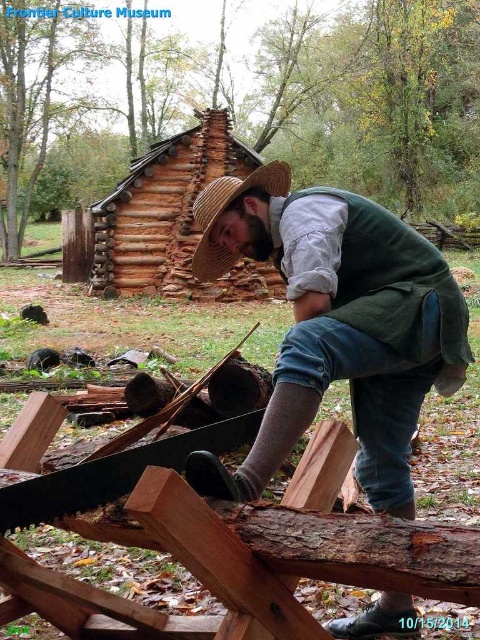
Question: Is green woolen vest at center below strawmaterial/texturehat at center?

Choices:
 (A) no
 (B) yes

Answer: (B)

Question: Which object is farther from the camera taking this photo?

Choices:
 (A) strawmaterial/texturehat at center
 (B) green woolen vest at center

Answer: (A)

Question: Which point is closer to the camera?

Choices:
 (A) (408, 278)
 (B) (215, 184)

Answer: (A)

Question: Can you confirm if green woolen vest at center is positioned to the left of strawmaterial/texturehat at center?

Choices:
 (A) yes
 (B) no

Answer: (B)

Question: Is green woolen vest at center wider than strawmaterial/texturehat at center?

Choices:
 (A) no
 (B) yes

Answer: (A)